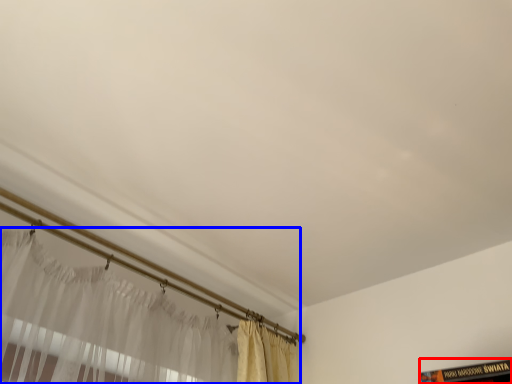
Question: Which object is closer to the camera taking this photo, book (highlighted by a red box) or curtain (highlighted by a blue box)?

Choices:
 (A) book
 (B) curtain

Answer: (A)